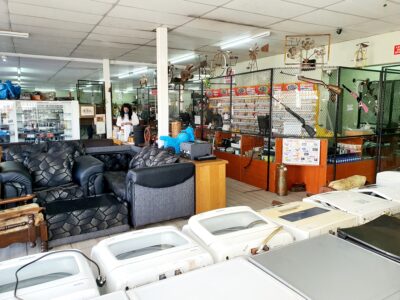
You are a GUI agent. You are given a task and a screenshot of the screen. Output one action in this format:
    pyautogui.click(x=<x>, y=<y>)
    Task: Click on the support posts
    This screenshot has height=300, width=400.
    Given the screenshot: What is the action you would take?
    pyautogui.click(x=162, y=88), pyautogui.click(x=108, y=88)